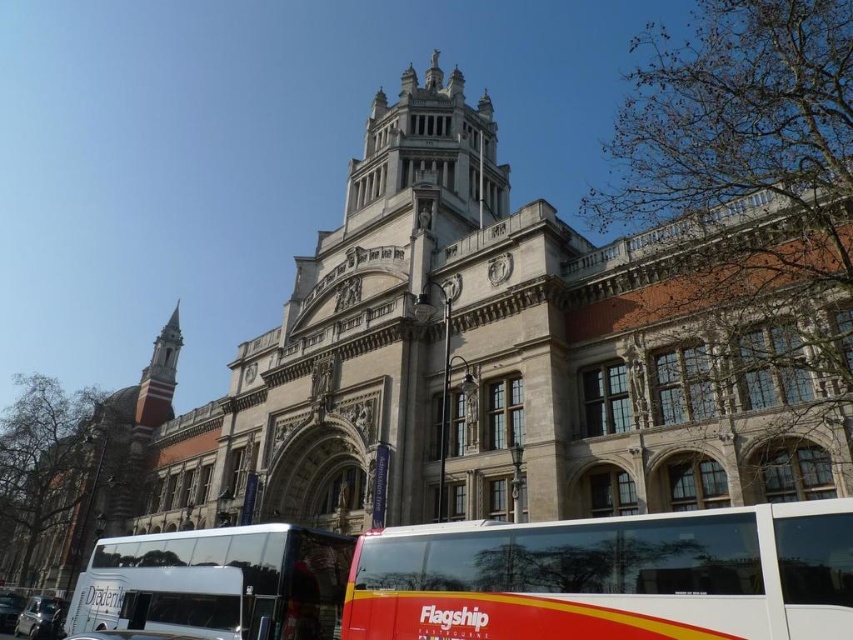
Between point (526, 609) and point (103, 540), which one is positioned in front?

Positioned in front is point (526, 609).

Can you confirm if white glossy bus at center is bigger than white glossy tour bus at lower left?

Correct, white glossy bus at center is larger in size than white glossy tour bus at lower left.

I want to click on white glossy bus at center, so click(x=610, y=577).